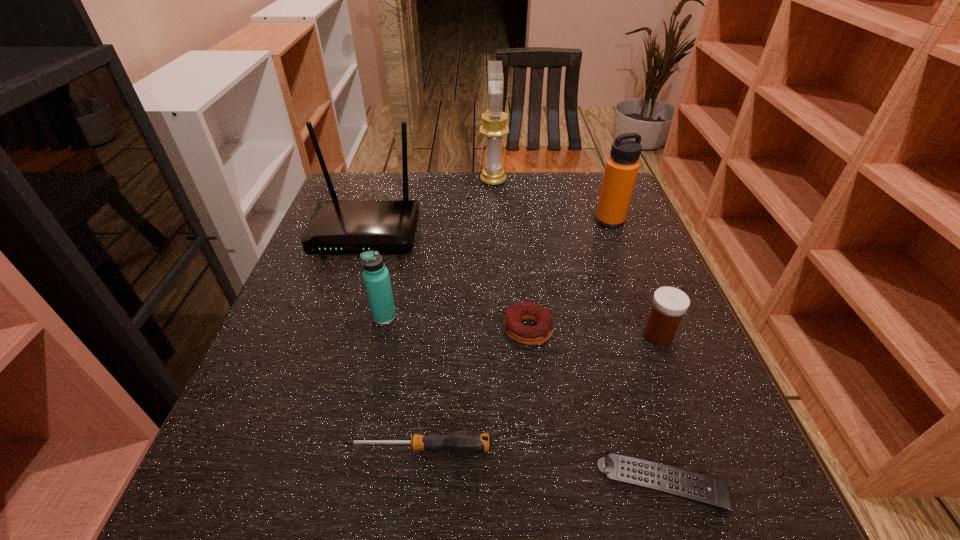
Where is `vacant space that satisfies the following two spatial constraints: 1. on the front-facing side of the router; 2. on the left side of the fifth shortest object`? Image resolution: width=960 pixels, height=540 pixels. vacant space that satisfies the following two spatial constraints: 1. on the front-facing side of the router; 2. on the left side of the fifth shortest object is located at coordinates (339, 316).

Locate an element on the screen. The image size is (960, 540). vacant space that satisfies the following two spatial constraints: 1. on the front-facing side of the farthest object; 2. on the front-facing side of the router is located at coordinates (495, 234).

Identify the location of vacant space that satisfies the following two spatial constraints: 1. on the front-facing side of the router; 2. on the right side of the shorter thermos bottle. (339, 316).

The width and height of the screenshot is (960, 540). In order to click on vacant area that satisfies the following two spatial constraints: 1. on the front-facing side of the award; 2. on the left side of the doughnut in this screenshot , I will do `click(499, 329)`.

What are the coordinates of `vacant area in the image that satisfies the following two spatial constraints: 1. on the back side of the doughnut; 2. on the front-facing side of the tallest object` in the screenshot? It's located at (512, 181).

You are a GUI agent. You are given a task and a screenshot of the screen. Output one action in this format:
    pyautogui.click(x=<x>, y=<y>)
    Task: Click on the vacant space that satisfies the following two spatial constraints: 1. on the front-facing side of the router; 2. on the left side of the fifth shortest object
    The image size is (960, 540).
    Given the screenshot: What is the action you would take?
    pyautogui.click(x=339, y=316)

Locate an element on the screen. This screenshot has width=960, height=540. vacant area in the image that satisfies the following two spatial constraints: 1. on the front-facing side of the taller thermos bottle; 2. on the right side of the farthest object is located at coordinates (495, 221).